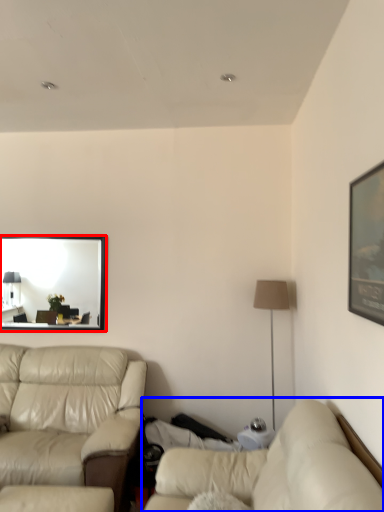
Question: Which point is closer to the camera, mirror (highlighted by a red box) or studio couch (highlighted by a blue box)?

Choices:
 (A) mirror
 (B) studio couch

Answer: (B)